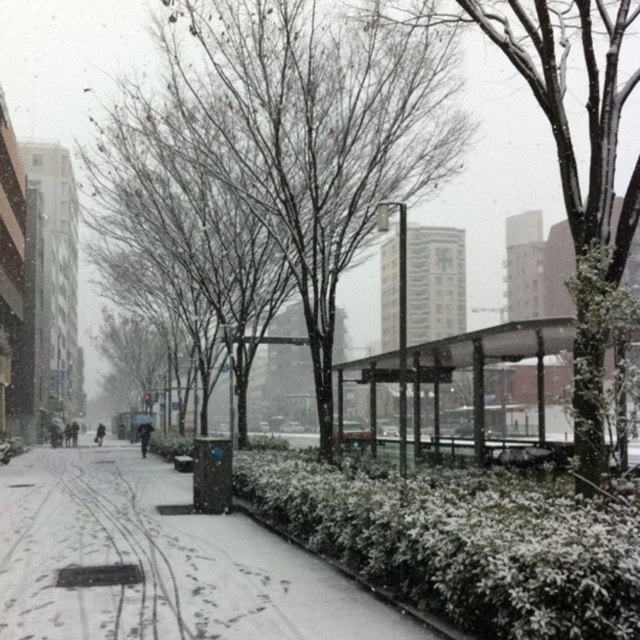
You are a city planner analyzing the urban space in the image. You need to determine if the transparent plastic bus stop at center can be moved closer to the bare branches at center without overlapping. Given their widths, what is your assessment?

The bare branches at center are wider than the transparent plastic bus stop at center. Since the bus stop is narrower, it can be moved closer to the branches without overlapping as long as there is sufficient space between them.